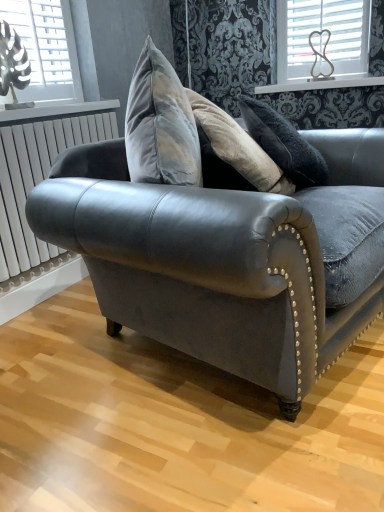
Question: Does point (1, 268) appear closer or farther from the camera than point (268, 367)?

Choices:
 (A) farther
 (B) closer

Answer: (A)

Question: From their relative heights in the image, would you say white metallic radiator at left is taller or shorter than velvet dark gray couch at center?

Choices:
 (A) short
 (B) tall

Answer: (A)

Question: Which object is the closest to the white metallic radiator at left?

Choices:
 (A) white plastic heart at upper right, which is the second window in front-to-back order
 (B) white glossy window sill at upper center
 (C) metallic silver window at upper left, which is the first window in left-to-right order
 (D) velvet dark gray couch at center

Answer: (C)

Question: Estimate the real-world distances between objects in this image. Which object is closer to the metallic silver window at upper left, the 1th window in the front-to-back sequence?

Choices:
 (A) white plastic heart at upper right, which is the second window in front-to-back order
 (B) velvet dark gray couch at center
 (C) white glossy window sill at upper center
 (D) white metallic radiator at left

Answer: (D)